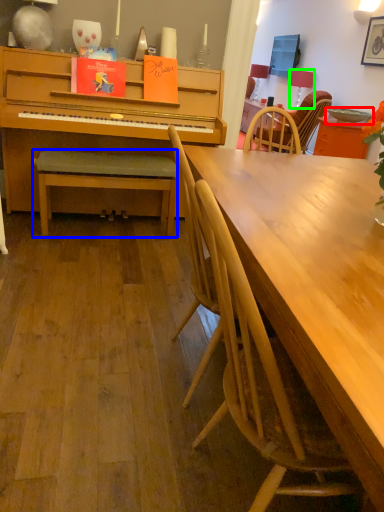
Question: Which object is positioned farthest from bowl (highlighted by a red box)? Select from bench (highlighted by a blue box) and lamp (highlighted by a green box).

Choices:
 (A) bench
 (B) lamp

Answer: (A)